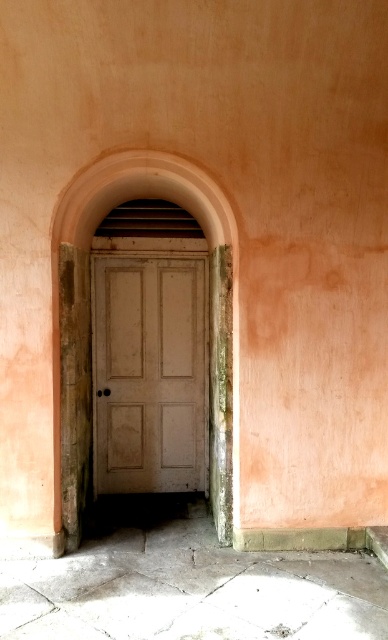
Question: Is white matte door at center behind smooth pink arch at center?

Choices:
 (A) no
 (B) yes

Answer: (B)

Question: Which of the following is the farthest from the observer?

Choices:
 (A) (148, 445)
 (B) (79, 381)

Answer: (A)

Question: In this image, where is white matte door at center located relative to smooth pink arch at center?

Choices:
 (A) above
 (B) below

Answer: (B)

Question: Among these objects, which one is farthest from the camera?

Choices:
 (A) smooth pink arch at center
 (B) white matte door at center

Answer: (B)

Question: Can you confirm if white matte door at center is positioned to the left of smooth pink arch at center?

Choices:
 (A) yes
 (B) no

Answer: (B)